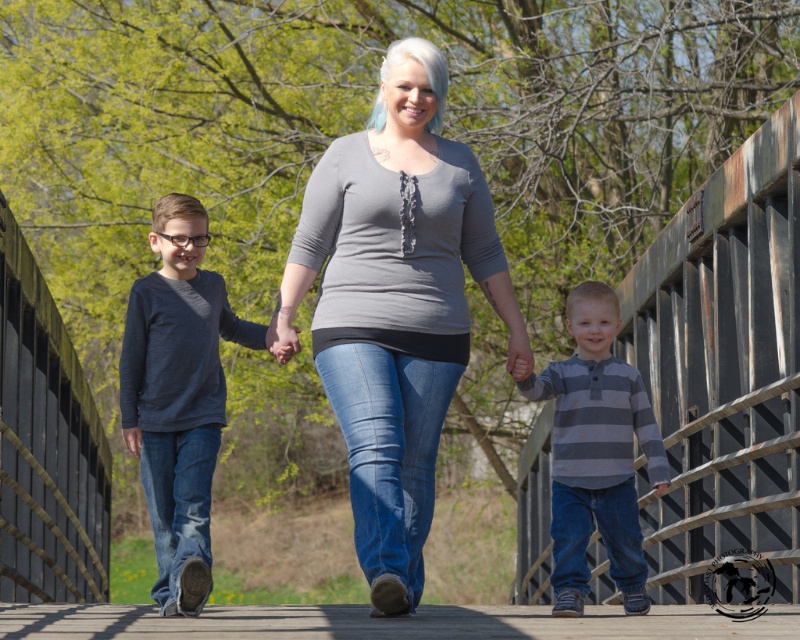
Question: Based on their relative distances, which object is farther from the gray striped shirt at center?

Choices:
 (A) gray textured shirt at center
 (B) dark blue denim jeans at left

Answer: (B)

Question: Is gray textured shirt at center further to the viewer compared to wooden bridge at center?

Choices:
 (A) no
 (B) yes

Answer: (B)

Question: Considering the relative positions of gray textured shirt at center and gray striped shirt at center in the image provided, where is gray textured shirt at center located with respect to gray striped shirt at center?

Choices:
 (A) below
 (B) above

Answer: (B)

Question: Which point appears farthest from the camera in this image?

Choices:
 (A) (156, 312)
 (B) (456, 232)
 (C) (586, 371)
 (D) (528, 618)

Answer: (C)

Question: Which point is farther to the camera?

Choices:
 (A) gray textured shirt at center
 (B) dark blue denim jeans at left

Answer: (B)

Question: Does gray striped shirt at center appear on the left side of wooden bridge at center?

Choices:
 (A) yes
 (B) no

Answer: (B)